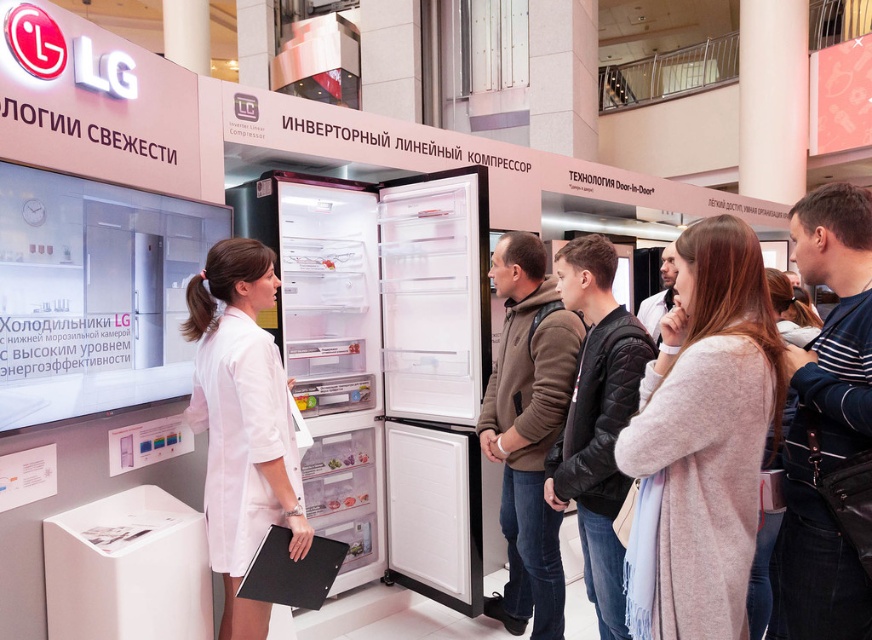
You are standing in the shopping mall and want to take a photo of the LG refrigerator display. You notice two points marked in the scene. The first point is at coordinates point (397,522) and the second is at point (230,310). Which point should you focus on to ensure the refrigerator is in the foreground of your photo?

You should focus on point (230,310) because point (397,522) is behind it, so focusing on the closer point will keep the refrigerator in the foreground.

You are a store employee who needs to move the brown hoodie at center to a different display rack. The display rack is located to the right of the white matte refrigerator at center. Can you move the hoodie without removing the refrigerator first?

The white matte refrigerator at center is wider than the brown hoodie at center. Since the display rack is to the right of the refrigerator, you can move the brown hoodie at center around the refrigerator or behind it without needing to remove the refrigerator first, as the hoodie is narrower and can navigate around the refrigerator.